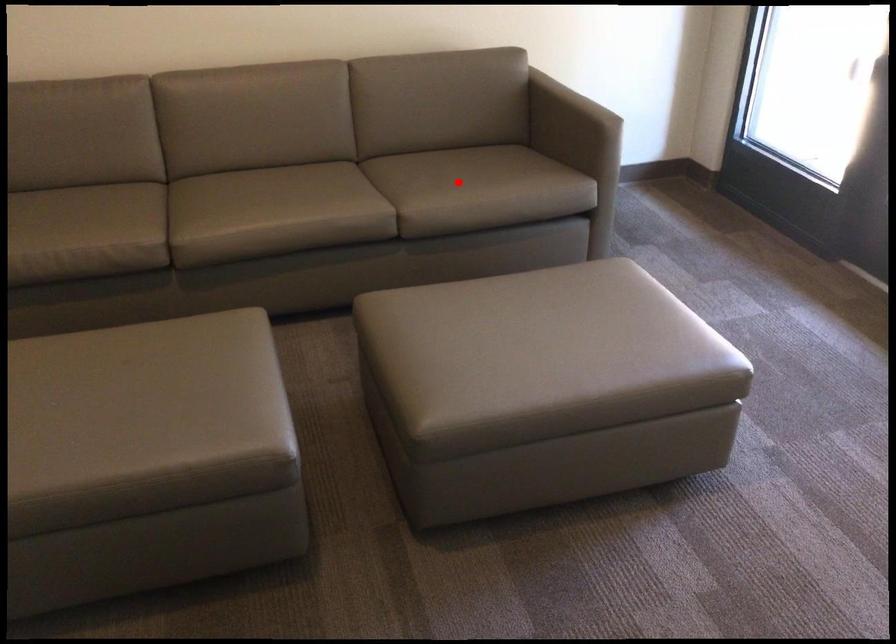
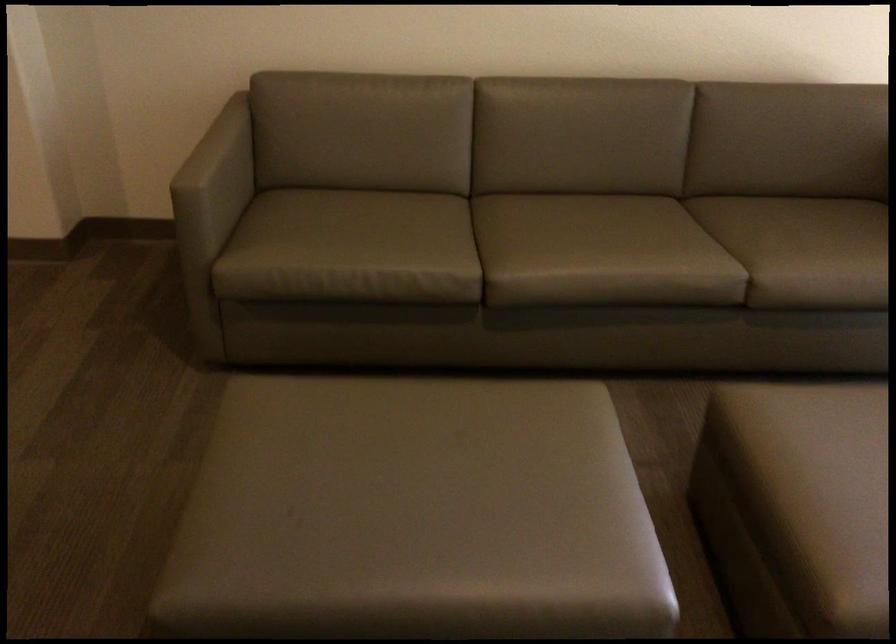
Question: I am providing you with two images of the same scene from different viewpoints. Given a red point in image1, look at the same physical point in image2. Is it:

Choices:
 (A) Closer to the viewpoint
 (B) Farther from the viewpoint

Answer: (A)